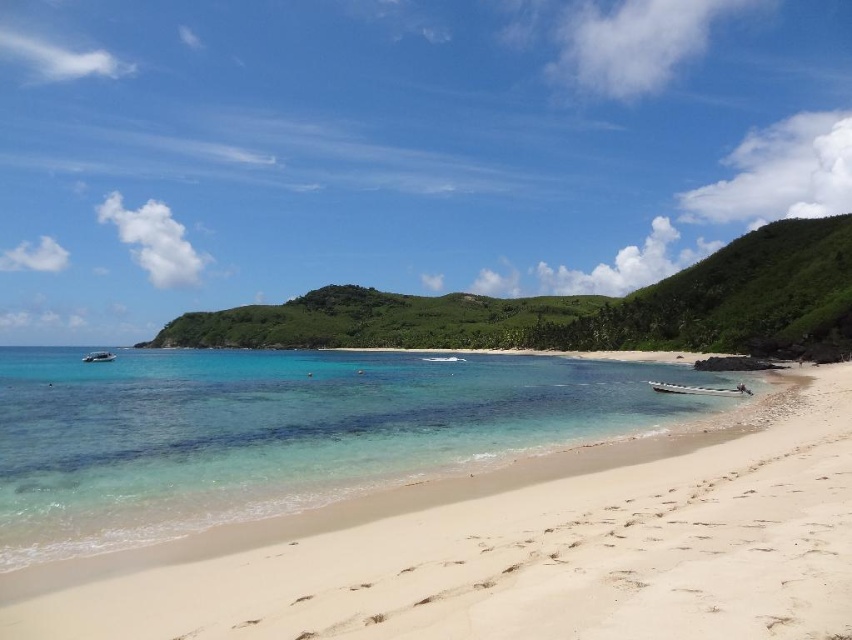
You are standing at the point with coordinates point [769,589] and want to walk towards the point with coordinates point [409,310]. Given the beach terrain described, will you have to walk uphill or downhill?

Since point [769,589] is in front of point [409,310], you will have to walk uphill towards point [409,310] because the sand slopes gently down towards the sea, meaning the direction away from the sea is uphill.

You are standing on the beach and want to take a photo of the green leafy island at center. If you position yourself at the point closest to the island, where would that be on the beach?

The closest point on the beach to the green leafy island at center would be directly in front of the island at the shoreline, which is approximately at the same x coordinate as the island, around 0.483 on the horizontal axis. Since the island is at 0.687 on the y axis, moving towards that coordinate along the beach would get you as close as possible.

You are standing on the beach and want to take a photo of the green leafy island at center. If your camera can focus up to 100 meters, will it be able to capture the island clearly?

The green leafy island at center and camera are 98.89 meters apart, so yes, the camera can focus on the green leafy island at center since it is within the 100 meters range.